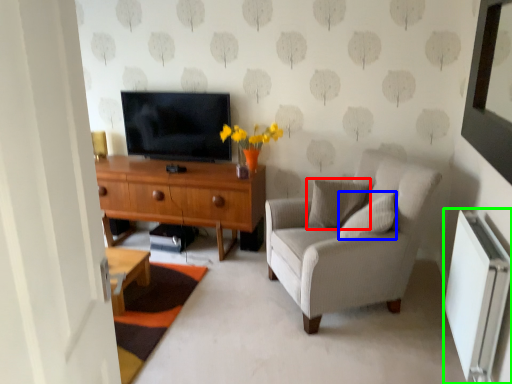
Question: Which is nearer to the pillow (highlighted by a red box)? pillow (highlighted by a blue box) or radiator (highlighted by a green box).

Choices:
 (A) pillow
 (B) radiator

Answer: (A)